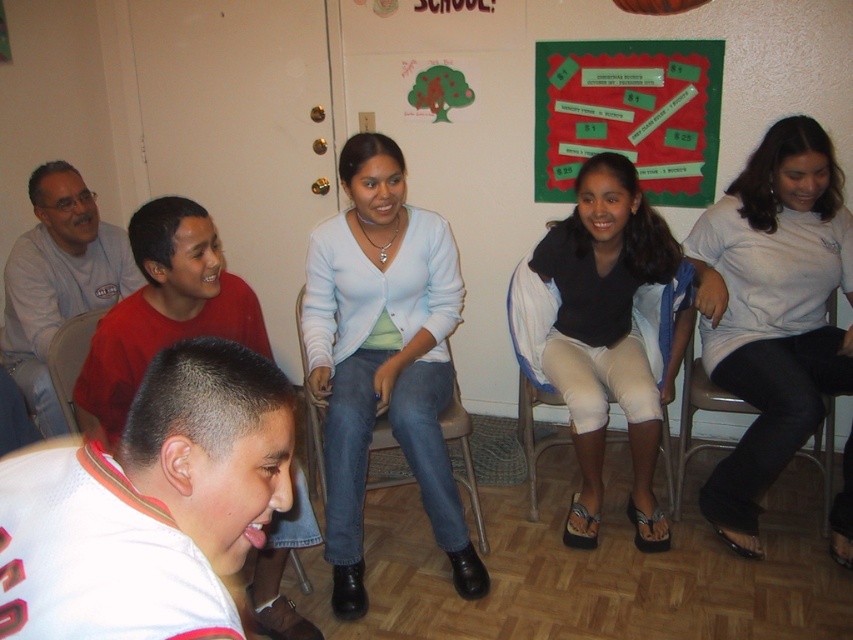
Can you confirm if white matte shirt at lower left is positioned above matte plastic chair at left?

Yes, white matte shirt at lower left is above matte plastic chair at left.

Identify the location of white matte shirt at lower left. (163, 308).

Can you confirm if white matte shirt at lower left is thinner than green paperboard at upper center?

Yes.

Between white matte shirt at lower left and green paperboard at upper center, which one appears on the left side from the viewer's perspective?

white matte shirt at lower left

Does point (189, 262) come behind point (598, 64)?

No, it is in front of (598, 64).

You are a GUI agent. You are given a task and a screenshot of the screen. Output one action in this format:
    pyautogui.click(x=<x>, y=<y>)
    Task: Click on the white matte shirt at lower left
    This screenshot has width=853, height=640.
    Given the screenshot: What is the action you would take?
    pyautogui.click(x=163, y=308)

Is light blue cardigan at center bigger than white matte shirt at lower left?

Correct, light blue cardigan at center is larger in size than white matte shirt at lower left.

Between light blue cardigan at center and white matte shirt at lower left, which one appears on the left side from the viewer's perspective?

white matte shirt at lower left

Looking at this image, who is more distant from viewer, (412, 465) or (109, 400)?

Positioned behind is point (412, 465).

Image resolution: width=853 pixels, height=640 pixels. I want to click on light blue cardigan at center, so click(383, 356).